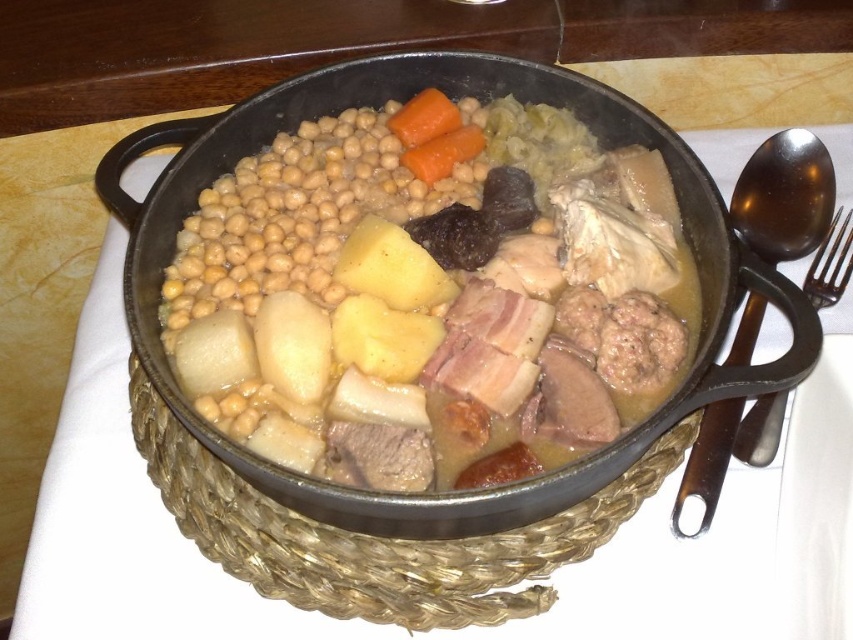
You are a chef standing at a distance of 20 inches from the golden brown stew at center. Can you reach it without moving closer?

The golden brown stew at center is 21.87 inches away from the viewer. Since you are standing at 20 inches, you are closer than the required distance, so yes, you can reach it without moving closer.

You are a chef preparing to serve this dish. You need to decide whether the shiny metal spoon at right can be placed into the golden brown stew at center without touching the bottom. Based on their heights, can the spoon fit vertically inside the stew?

The golden brown stew at center is shorter than the shiny metal spoon at right, so the spoon is taller than the stew. Therefore, if placed vertically, the spoon would extend beyond the stew and touch the bottom of the pot, making it unsuitable for serving without contact.